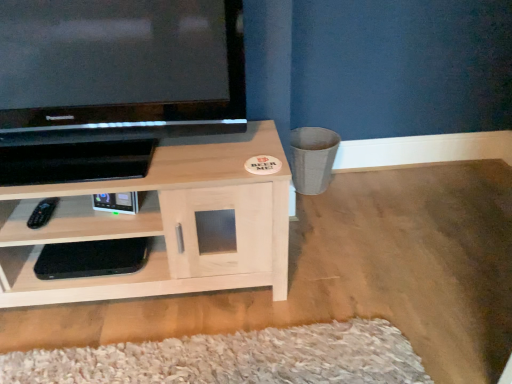
Question: Should I look upward or downward to see light wood/woodenobject at lower left, the 1th shelf from the top?

Choices:
 (A) up
 (B) down

Answer: (B)

Question: Does black plastic remote at lower left have a greater width compared to light wood/woodenobject at lower left, the 1th shelf from the top?

Choices:
 (A) yes
 (B) no

Answer: (B)

Question: Does black plastic remote at lower left have a lesser height compared to light wood/woodenobject at lower left, the second shelf when ordered from bottom to top?

Choices:
 (A) yes
 (B) no

Answer: (A)

Question: From a real-world perspective, is black plastic remote at lower left beneath light wood/woodenobject at lower left, the second shelf when ordered from bottom to top?

Choices:
 (A) no
 (B) yes

Answer: (A)

Question: Can you confirm if black plastic remote at lower left is smaller than light wood/woodenobject at lower left, the second shelf when ordered from bottom to top?

Choices:
 (A) no
 (B) yes

Answer: (B)

Question: Does black plastic remote at lower left have a larger size compared to light wood/woodenobject at lower left, the 1th shelf from the top?

Choices:
 (A) no
 (B) yes

Answer: (A)

Question: Is black plastic remote at lower left outside of light wood/woodenobject at lower left, the 1th shelf from the top?

Choices:
 (A) no
 (B) yes

Answer: (A)

Question: Is black glossy television at upper left turned away from black plastic remote at lower left?

Choices:
 (A) yes
 (B) no

Answer: (B)

Question: Considering the relative sizes of black glossy television at upper left and black plastic remote at lower left in the image provided, is black glossy television at upper left shorter than black plastic remote at lower left?

Choices:
 (A) no
 (B) yes

Answer: (A)

Question: From a real-world perspective, is black glossy television at upper left on top of black plastic remote at lower left?

Choices:
 (A) no
 (B) yes

Answer: (B)

Question: Considering the relative sizes of black glossy television at upper left and black plastic remote at lower left in the image provided, is black glossy television at upper left thinner than black plastic remote at lower left?

Choices:
 (A) no
 (B) yes

Answer: (A)

Question: Is black glossy television at upper left wider than black plastic remote at lower left?

Choices:
 (A) yes
 (B) no

Answer: (A)

Question: Considering the relative sizes of black glossy television at upper left and black plastic remote at lower left in the image provided, is black glossy television at upper left smaller than black plastic remote at lower left?

Choices:
 (A) yes
 (B) no

Answer: (B)

Question: Is light wood/woodenobject at lower left, the 1th shelf from the top, smaller than black glossy television at upper left?

Choices:
 (A) yes
 (B) no

Answer: (B)